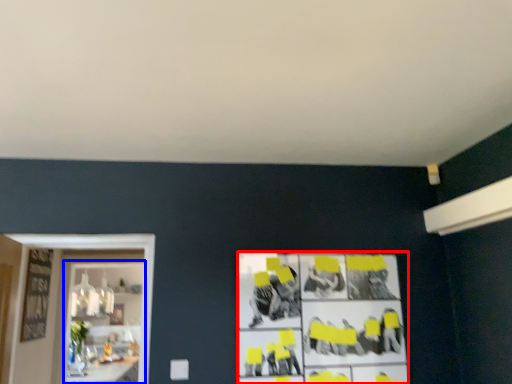
Question: Which object appears closest to the camera in this image, poster (highlighted by a red box) or shelf (highlighted by a blue box)?

Choices:
 (A) poster
 (B) shelf

Answer: (A)